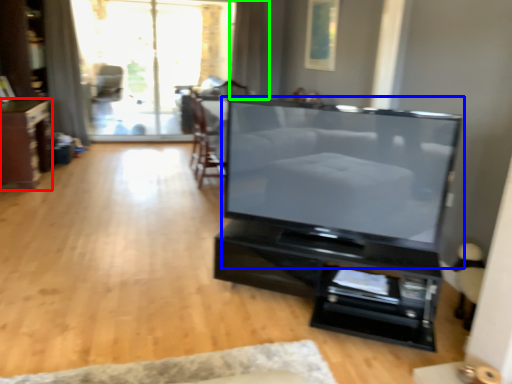
Question: Which object is the closest to the furniture (highlighted by a red box)? Choose among these: television (highlighted by a blue box) or curtain (highlighted by a green box).

Choices:
 (A) television
 (B) curtain

Answer: (B)